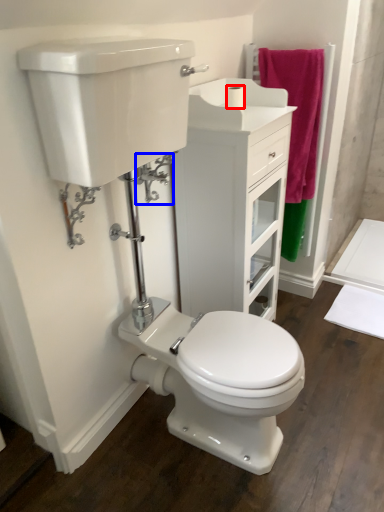
Question: Which object is further to the camera taking this photo, toilet paper (highlighted by a red box) or plumbing fixture (highlighted by a blue box)?

Choices:
 (A) toilet paper
 (B) plumbing fixture

Answer: (A)